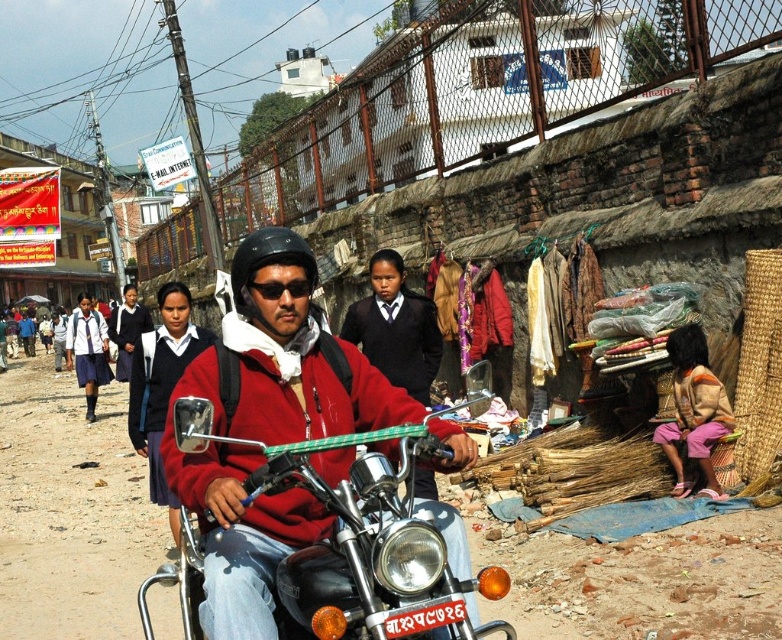
Which is more to the left, shiny chrome motorcycle at center or matte black helmet at upper center?

Positioned to the left is matte black helmet at upper center.

Does point (207, 538) come farther from viewer compared to point (142, 336)?

No, it is not.

This screenshot has height=640, width=782. I want to click on shiny chrome motorcycle at center, so click(320, 504).

Is point (185, 291) positioned before point (106, 348)?

That is True.

Which is more to the left, matte black helmet at upper center or white uniform at center?

Positioned to the left is white uniform at center.

Locate an element on the screen. matte black helmet at upper center is located at coordinates (160, 385).

Is point (418, 449) in front of point (249, 288)?

Yes, it is in front of point (249, 288).

Which is behind, point (246, 387) or point (291, 285)?

The point (246, 387) is more distant.

Locate an element on the screen. The width and height of the screenshot is (782, 640). shiny chrome motorcycle at center is located at coordinates (320, 504).